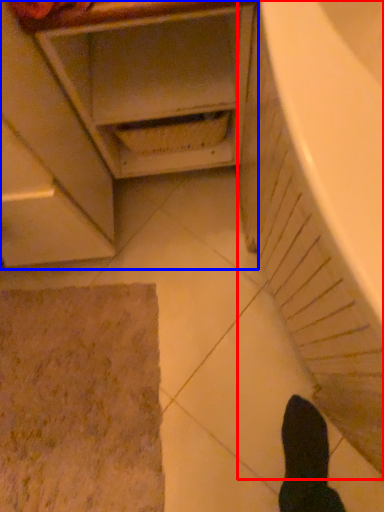
Question: Which of the following is the farthest to the observer, bath (highlighted by a red box) or cabinetry (highlighted by a blue box)?

Choices:
 (A) bath
 (B) cabinetry

Answer: (B)